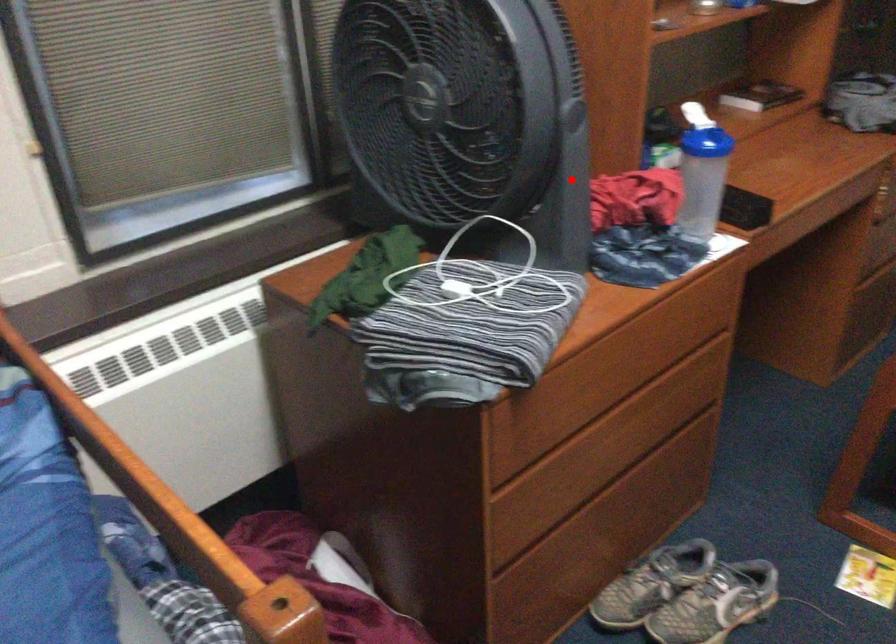
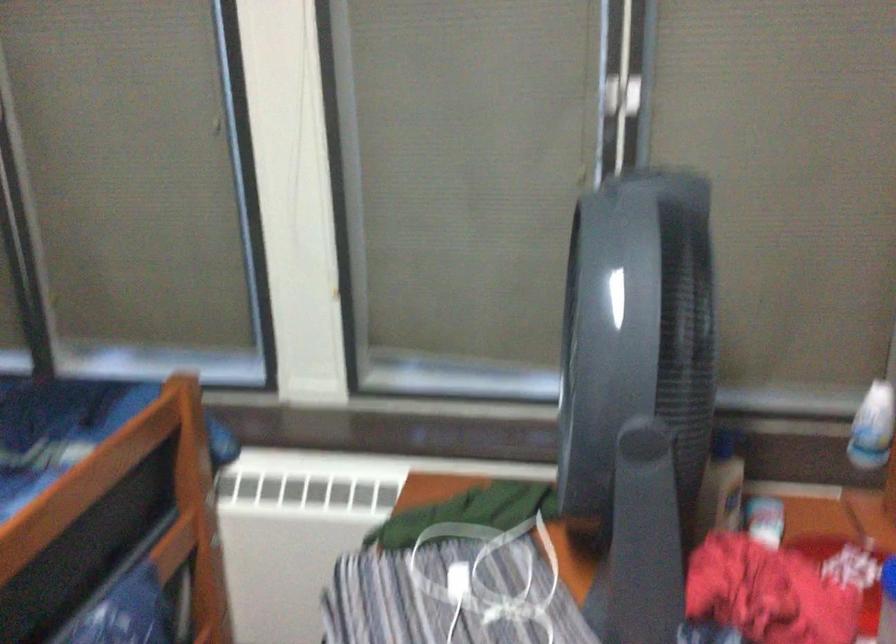
Question: A red point is marked in image1. In image2, is the corresponding 3D point closer to the camera or farther? Reply with the corresponding letter.

Choices:
 (A) The corresponding 3D point is closer.
 (B) The corresponding 3D point is farther.

Answer: (A)